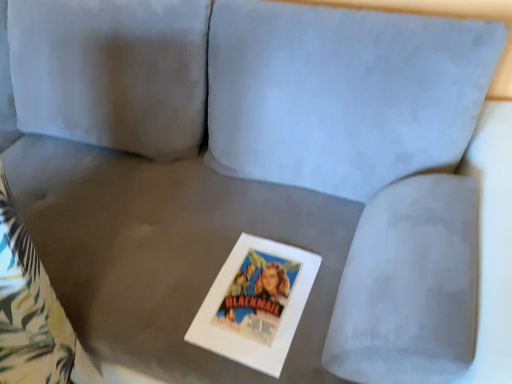
Measure the distance between matte white paperback book at center and camera.

The depth of matte white paperback book at center is 32.72 inches.

Image resolution: width=512 pixels, height=384 pixels. Find the location of `matte white paperback book at center`. matte white paperback book at center is located at coordinates (256, 303).

Describe the element at coordinates (256, 303) in the screenshot. I see `matte white paperback book at center` at that location.

Locate an element on the screen. matte white paperback book at center is located at coordinates (256, 303).